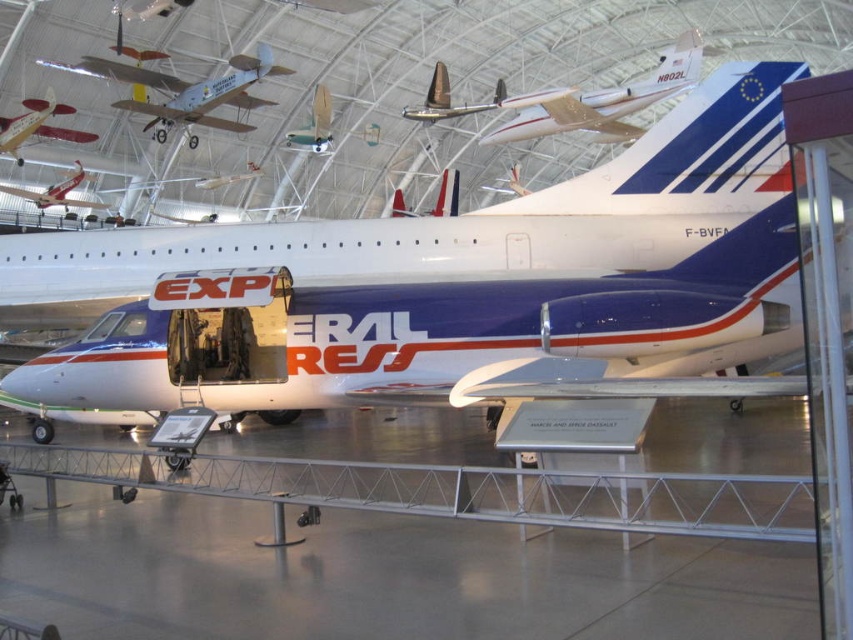
Looking at this image, who is positioned more to the right, metallic silver sailboat at upper center or metallic silver airplane at upper left?

metallic silver sailboat at upper center

Between point (314, 116) and point (67, 188), which one is positioned behind?

The point (67, 188) is behind.

Is point (300, 144) positioned in front of point (9, 193)?

Yes.

Where is `metallic silver sailboat at upper center`? Image resolution: width=853 pixels, height=640 pixels. metallic silver sailboat at upper center is located at coordinates (314, 124).

This screenshot has width=853, height=640. Describe the element at coordinates (450, 99) in the screenshot. I see `shiny silver airplane at center` at that location.

Does shiny silver airplane at center have a smaller size compared to metallic silver sailboat at upper center?

No.

Where is `shiny silver airplane at center`? The image size is (853, 640). shiny silver airplane at center is located at coordinates (450, 99).

Where is `shiny silver airplane at center`? The width and height of the screenshot is (853, 640). shiny silver airplane at center is located at coordinates (450, 99).

Can you confirm if metallic gold airplane at upper center is positioned above matte white airplane at center?

Yes, metallic gold airplane at upper center is above matte white airplane at center.

Looking at this image, who is more distant from viewer, [520,100] or [439,205]?

The point [439,205] is more distant.

Which is behind, point (578, 109) or point (393, 204)?

The point (393, 204) is more distant.

Locate an element on the screen. metallic gold airplane at upper center is located at coordinates (601, 100).